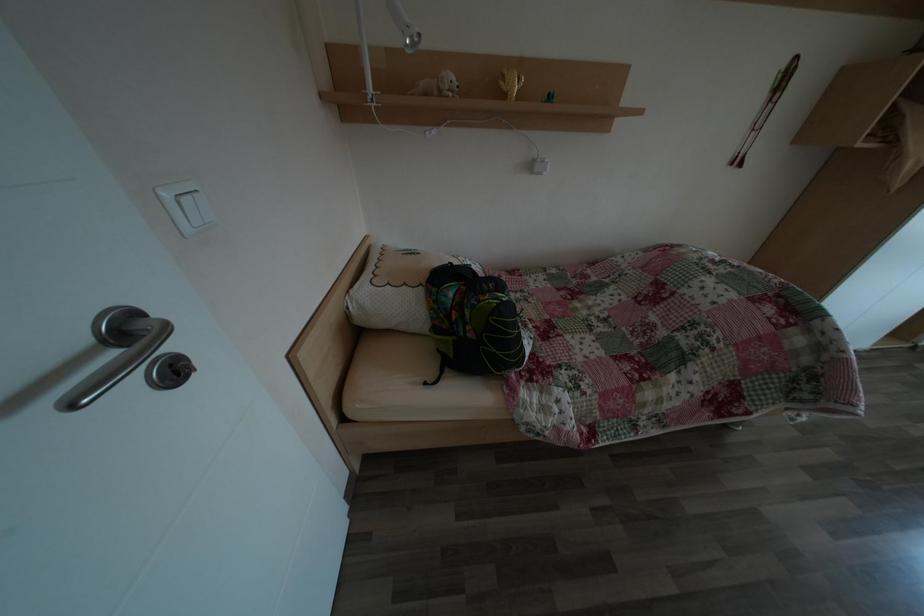
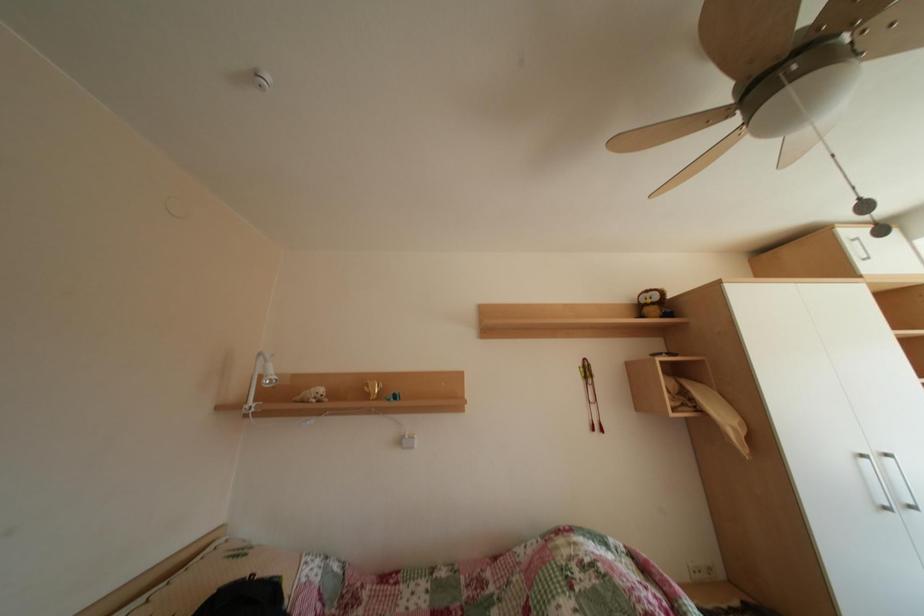
Question: Based on the continuous images, in which direction is the camera rotating? Reply with the corresponding letter.

Choices:
 (A) Left
 (B) Right
 (C) Up
 (D) Down

Answer: (C)